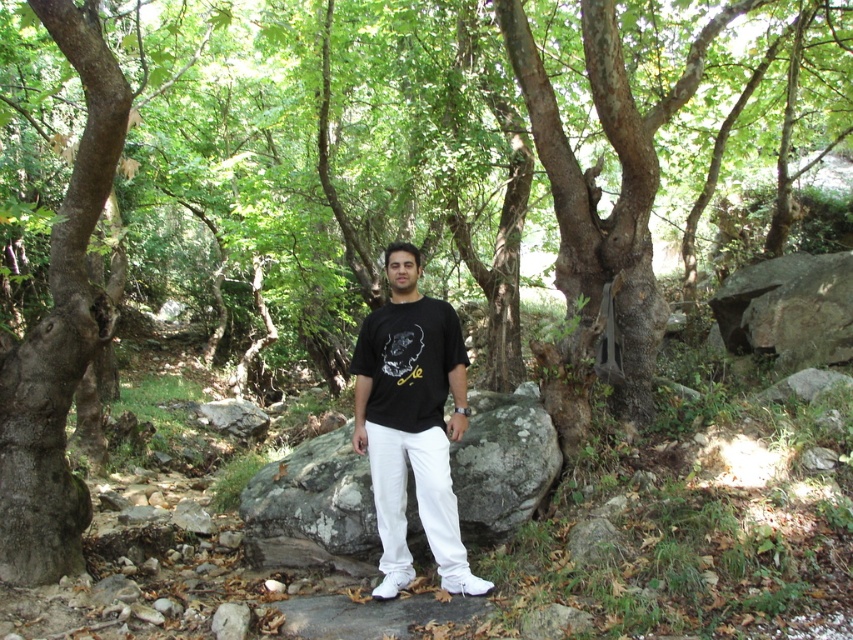
From the picture: You are a hiker trying to navigate through the forest. You see the gray rough boulder at center marked by point (312, 508). If you want to reach the boulder from your current position, which direction should you move relative to the boulder?

The gray rough boulder at center is located at point (312, 508), so you should move towards that coordinate to reach it.